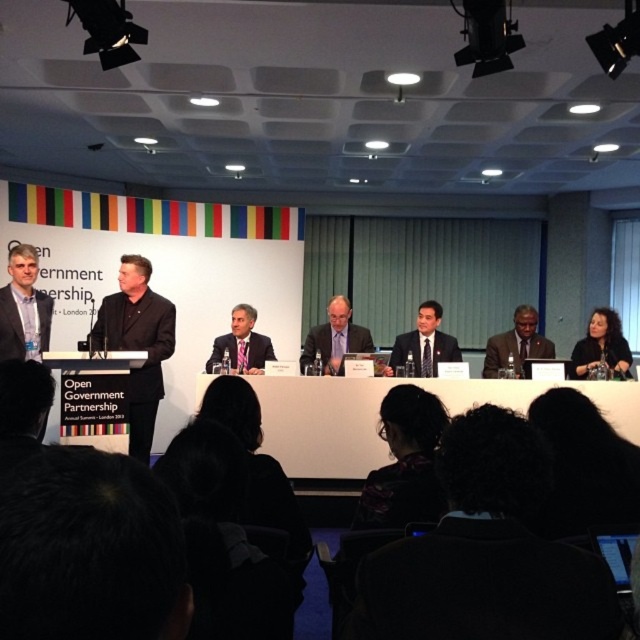
You are an event organizer who needs to place a large decorative centerpiece on the table. Considering the white glossy table at center and the black matte suit at center, will the table have enough space for the centerpiece without overlapping the suit?

The white glossy table at center is bigger than the black matte suit at center, so there should be enough space to place the centerpiece without overlapping the suit.

You are a photographer positioned at the back of the room. You want to take a photo of both the point at (253, 385) and the point at (131, 291). Which point should you focus on first to ensure both are in sharp focus?

You should focus on the point at (253, 385) first because it is closer to you than the point at (131, 291). By focusing on the closer point, the farther point will also be in focus if they are within the depth of field.